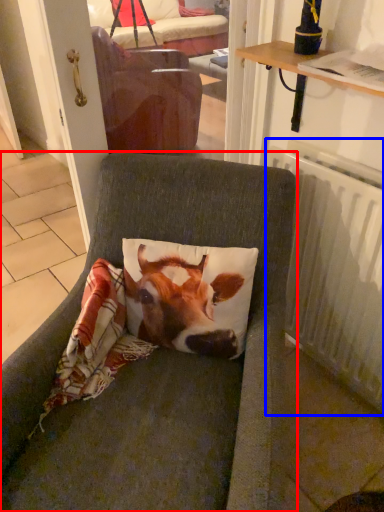
Question: Which object appears farthest to the camera in this image, chair (highlighted by a red box) or radiator (highlighted by a blue box)?

Choices:
 (A) chair
 (B) radiator

Answer: (B)